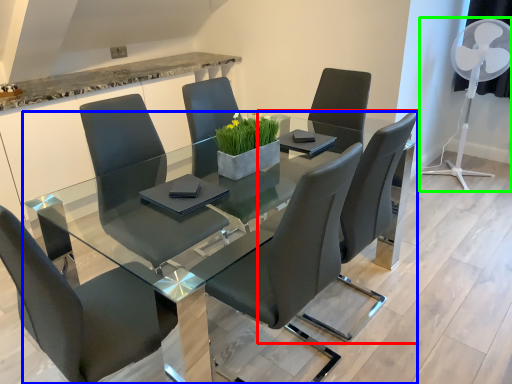
Question: Estimate the real-world distances between objects in this image. Which object is farther from chair (highlighted by a red box), table (highlighted by a blue box) or mechanical fan (highlighted by a green box)?

Choices:
 (A) table
 (B) mechanical fan

Answer: (B)